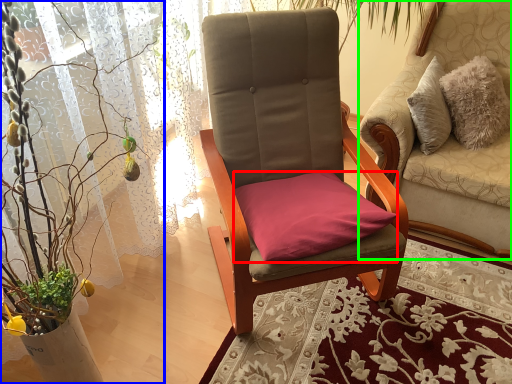
Question: Considering the real-world distances, which object is closest to pillow (highlighted by a red box)? houseplant (highlighted by a blue box) or chair (highlighted by a green box).

Choices:
 (A) houseplant
 (B) chair

Answer: (A)